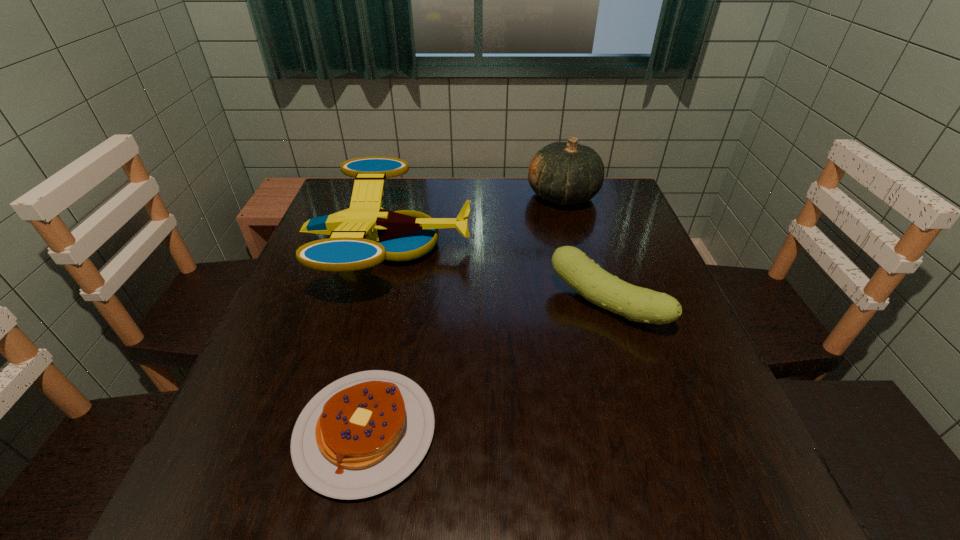
This screenshot has width=960, height=540. Find the location of `free space between the second tallest object and the second shortest object`. free space between the second tallest object and the second shortest object is located at coordinates (498, 276).

The image size is (960, 540). What are the coordinates of `free space between the second tallest object and the third tallest object` in the screenshot? It's located at (498, 276).

You are a GUI agent. You are given a task and a screenshot of the screen. Output one action in this format:
    pyautogui.click(x=<x>, y=<y>)
    Task: Click on the free area in between the cucumber and the gourd
    This screenshot has height=540, width=960.
    Given the screenshot: What is the action you would take?
    pyautogui.click(x=585, y=251)

Where is `vacant space in between the second shortest object and the pancake`? vacant space in between the second shortest object and the pancake is located at coordinates 486,368.

Find the location of a particular element. Image resolution: width=960 pixels, height=540 pixels. vacant space that is in between the gourd and the cucumber is located at coordinates coord(585,251).

In order to click on object that is the closest one to the nearest object in this screenshot , I will do `click(364, 235)`.

Identify which object is the third closest to the tallest object. Please provide its 2D coordinates. Your answer should be formatted as a tuple, i.e. [(x, y)], where the tuple contains the x and y coordinates of a point satisfying the conditions above.

[(361, 435)]

Locate an element on the screen. free location that satisfies the following two spatial constraints: 1. on the front side of the gourd; 2. on the left side of the cucumber is located at coordinates (592, 305).

The image size is (960, 540). In order to click on free space that satisfies the following two spatial constraints: 1. on the back side of the third tallest object; 2. at the cockpit of the second tallest object in this screenshot , I will do `click(588, 246)`.

Locate an element on the screen. The image size is (960, 540). vacant space that satisfies the following two spatial constraints: 1. at the cockpit of the second shortest object; 2. on the right side of the third shortest object is located at coordinates (374, 305).